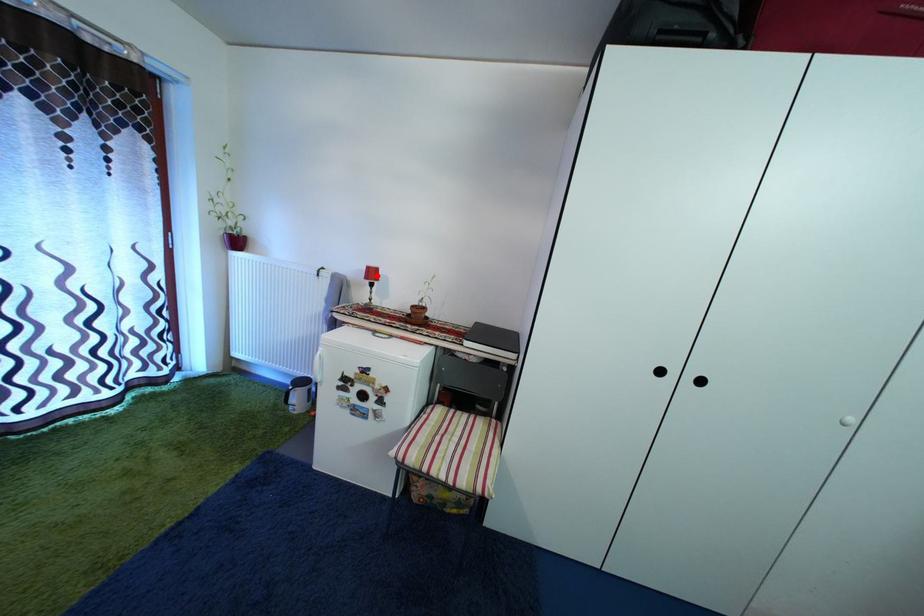
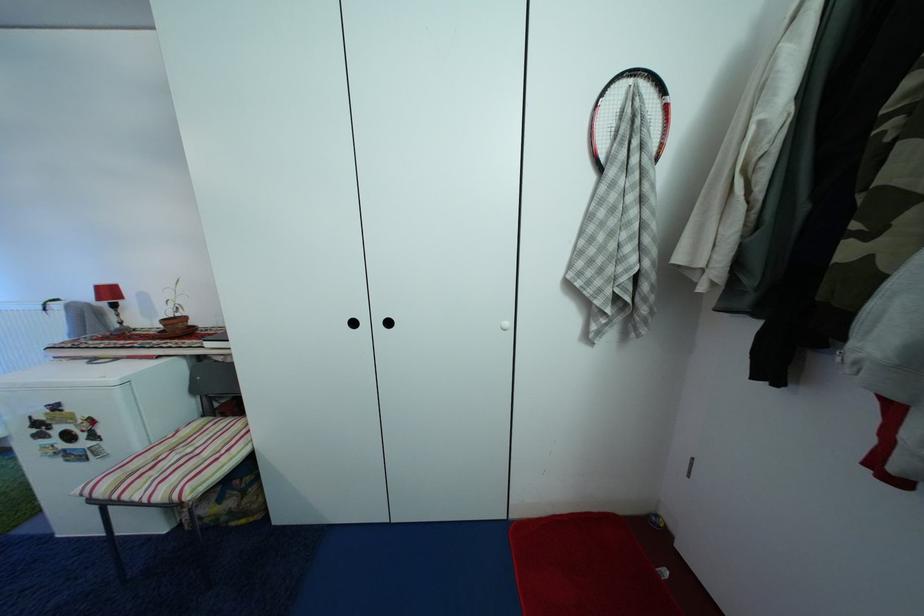
Where in the second image is the point corresponding to the highlighted location from the first image?

(106, 294)